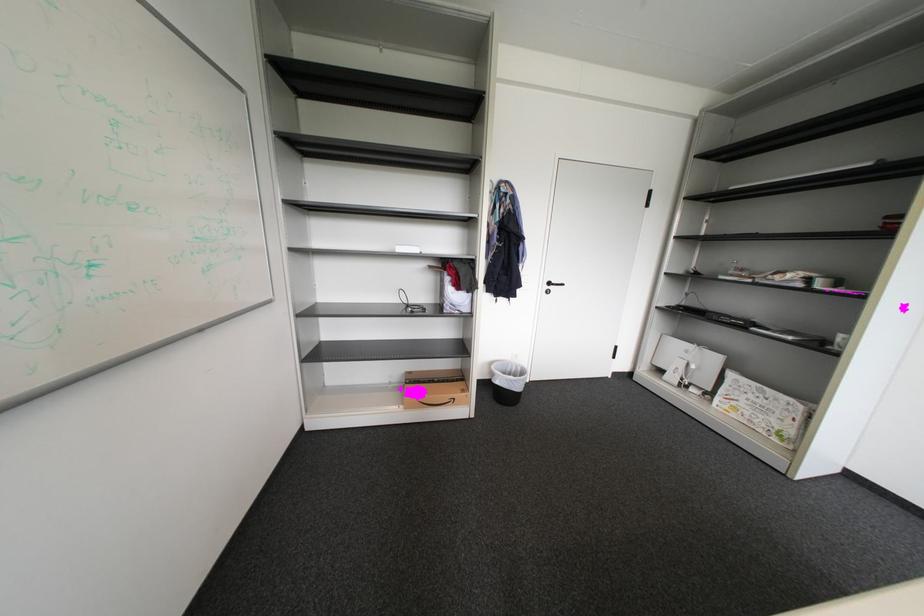
The width and height of the screenshot is (924, 616). What do you see at coordinates (553, 285) in the screenshot? I see `the black door handle` at bounding box center [553, 285].